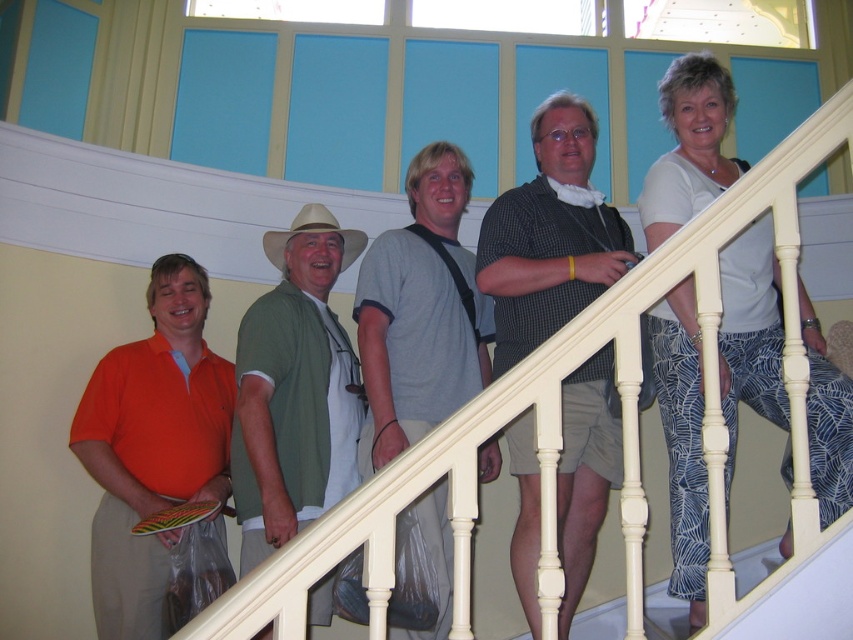
Question: Which point appears closest to the camera in this image?

Choices:
 (A) (241, 428)
 (B) (407, 182)

Answer: (A)

Question: Is the position of white painted wood at upper center more distant than that of tan straw cowboy hat at center?

Choices:
 (A) no
 (B) yes

Answer: (A)

Question: Which point is farther from the camera taking this photo?

Choices:
 (A) (590, 461)
 (B) (352, 257)
 (C) (283, 458)

Answer: (B)

Question: Does gray cotton t-shirt at center appear under tan straw cowboy hat at center?

Choices:
 (A) yes
 (B) no

Answer: (A)

Question: Which of the following is the farthest from the observer?

Choices:
 (A) (570, 435)
 (B) (558, 387)
 (C) (347, 234)

Answer: (C)

Question: Is checkered shirt at center above gray cotton t-shirt at center?

Choices:
 (A) yes
 (B) no

Answer: (A)